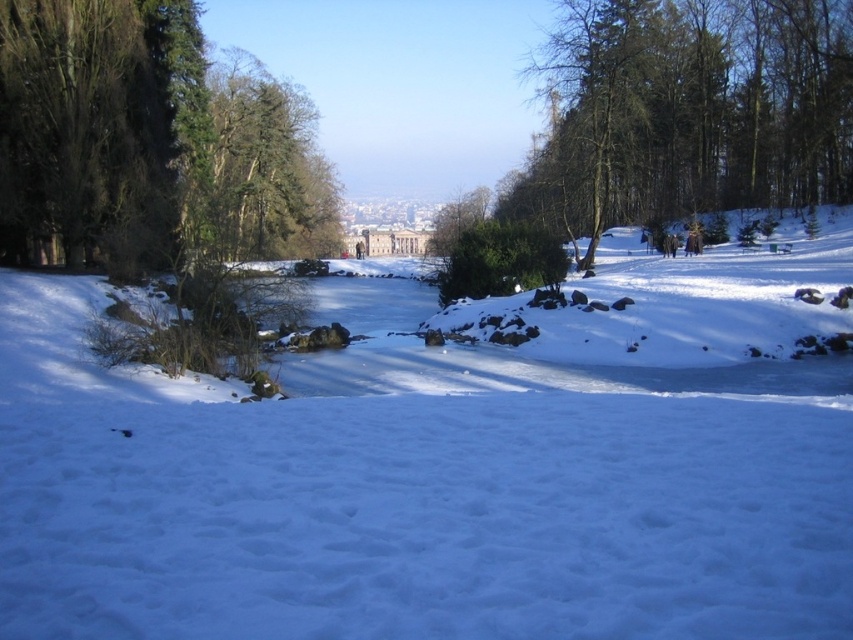
You are an observer standing at the edge of the snow. You see the white fluffy snow at center and the green leafy tree at center. Which object is closer to you?

The white fluffy snow at center is closer to you because it is positioned under the green leafy tree at center, which places it in front of the tree from your perspective.

You are standing in the winter landscape and want to determine which object is taller between the white fluffy snow at center and the green leafy tree at center. Based on the scene, which one is taller?

The green leafy tree at center is taller than the white fluffy snow at center.

You are an observer standing at the edge of the snow in the winter landscape. You notice the white fluffy snow at center and the green matte tree at upper center. Which object takes up more space in the image?

The green matte tree at upper center takes up more space in the image because it is larger than the white fluffy snow at center.